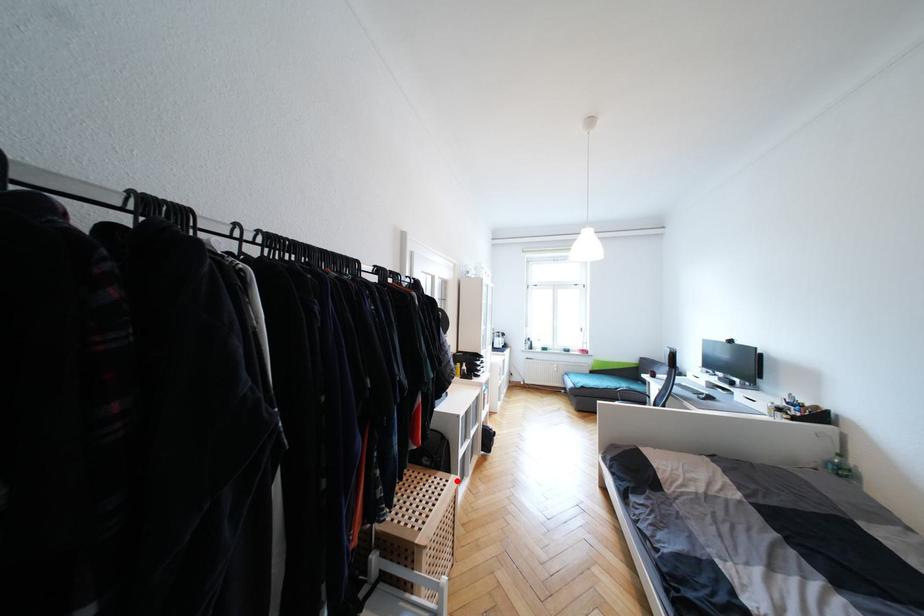
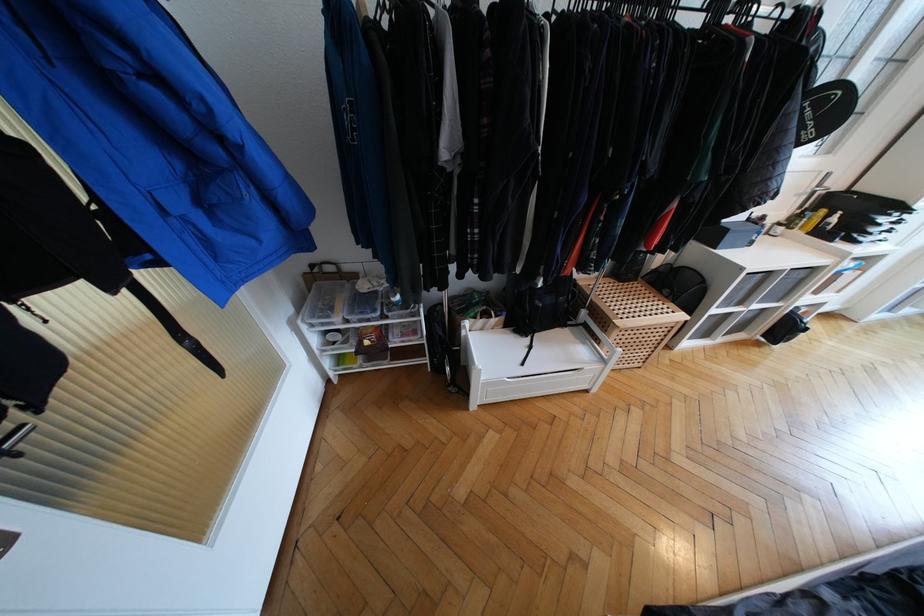
Question: I am providing you with two images of the same scene from different viewpoints. A red point is shown in image1. For the corresponding object point in image2, is it positioned nearer or farther from the camera?

Choices:
 (A) Nearer
 (B) Farther

Answer: (B)